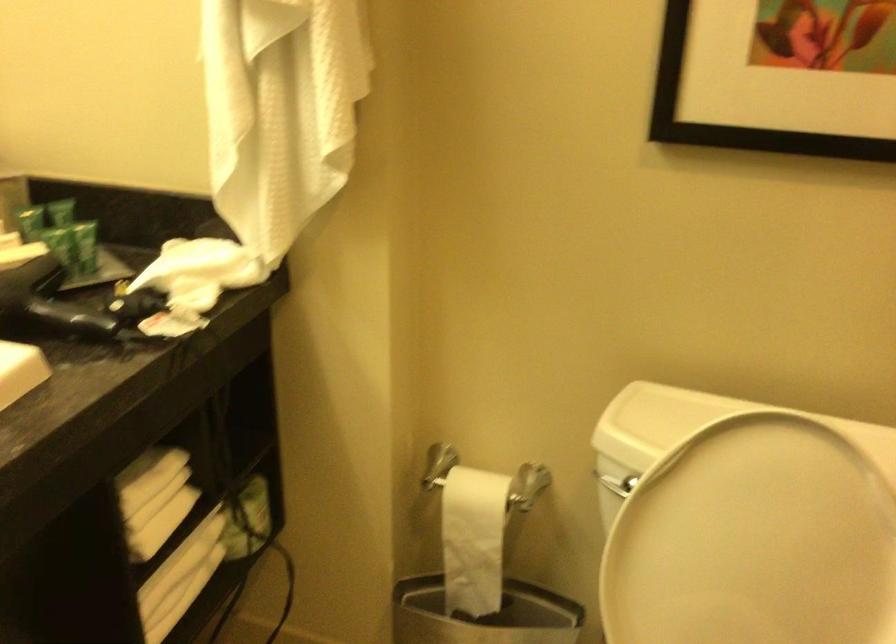
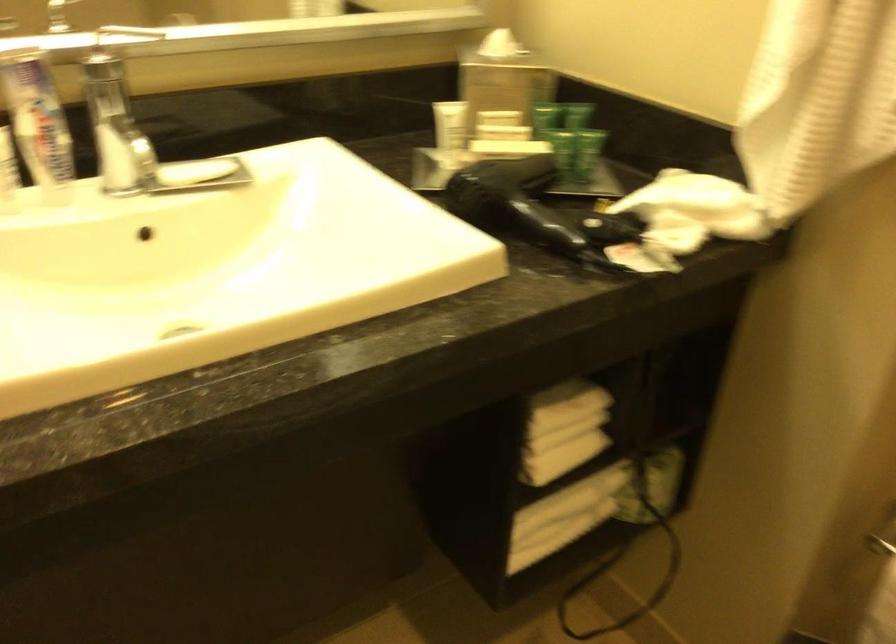
The point at (153, 498) is marked in the first image. Where is the corresponding point in the second image?

(563, 430)